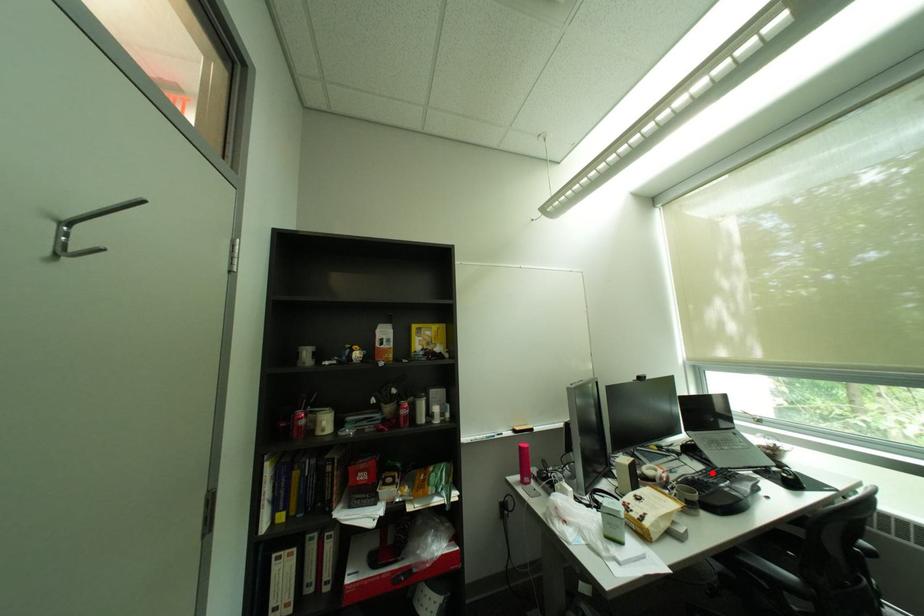
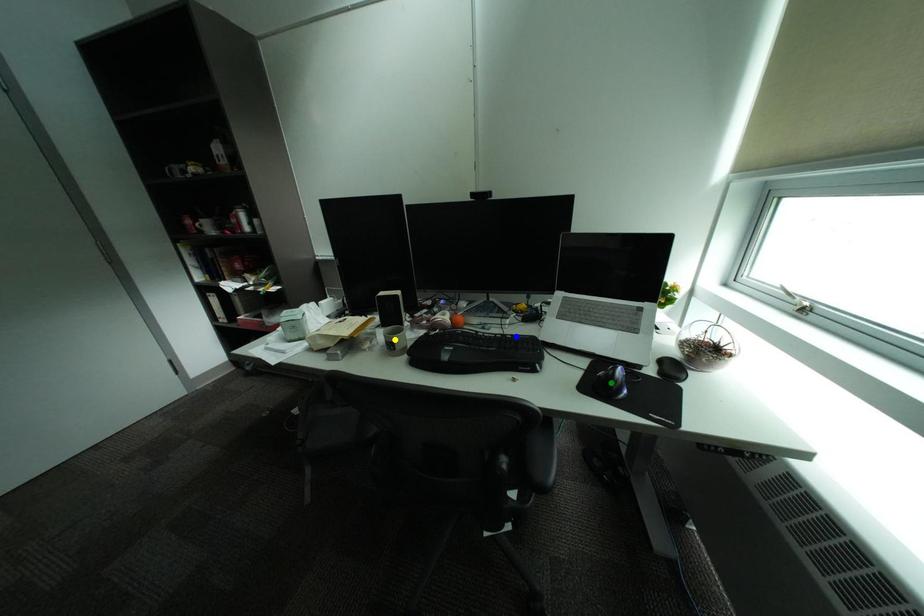
Question: I am providing you with two images of the same scene from different viewpoints. A red point is marked on the first image. You are given multiple points on the second image. Which point in image 2 is actually the same real-world point as the red point in image 1?

Choices:
 (A) green point
 (B) yellow point
 (C) blue point

Answer: (C)